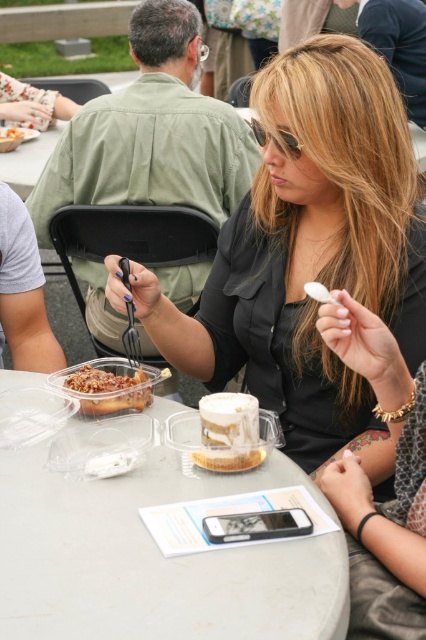
Question: Which of the following is the closest to the observer?

Choices:
 (A) (0, 128)
 (B) (146, 12)
 (C) (186, 476)
 (D) (293, 138)

Answer: (C)

Question: Among these objects, which one is nearest to the camera?

Choices:
 (A) white plastic table at center
 (B) matte brown pie at center
 (C) shiny brown meat at center

Answer: (A)

Question: Does clear plastic table at upper left have a lesser width compared to gold metallic sunglasses at center?

Choices:
 (A) no
 (B) yes

Answer: (A)

Question: Where is gold metallic sunglasses at center located in relation to matte brown pie at center in the image?

Choices:
 (A) above
 (B) below

Answer: (B)

Question: Estimate the real-world distances between objects in this image. Which object is farther from the shiny brown meat at center?

Choices:
 (A) gold metallic sunglasses at center
 (B) white frosted cake at center
 (C) white plastic table at center
 (D) clear plastic table at upper left

Answer: (D)

Question: Can you confirm if green fabric shirt at upper left is positioned to the left of white frosted cake at center?

Choices:
 (A) yes
 (B) no

Answer: (A)